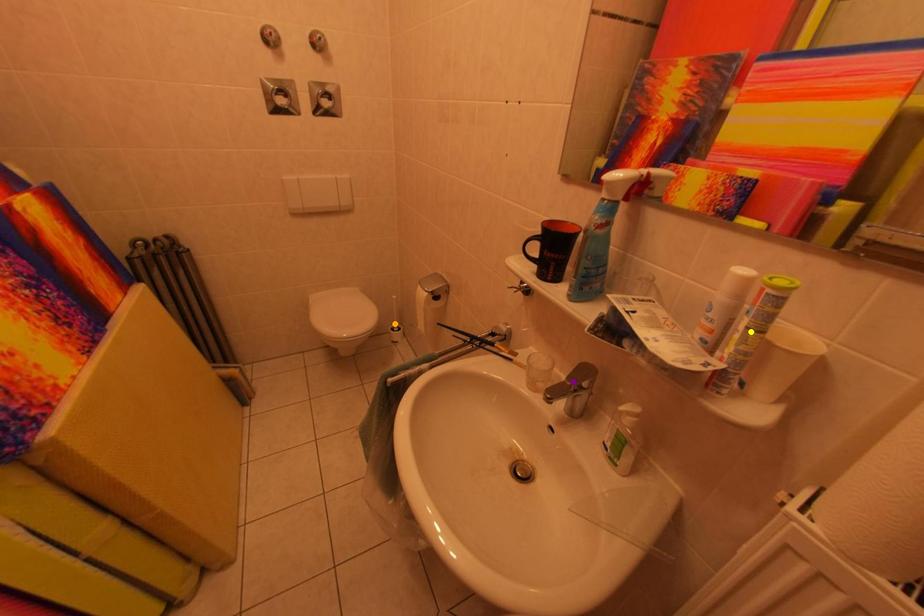
Order these from nearest to farthest:
yellow point | orange point | purple point

yellow point, purple point, orange point